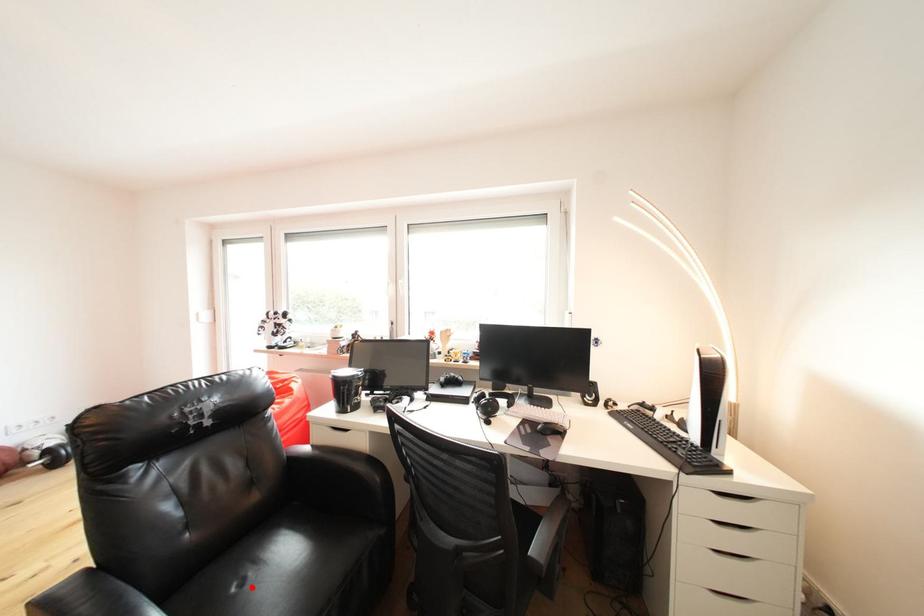
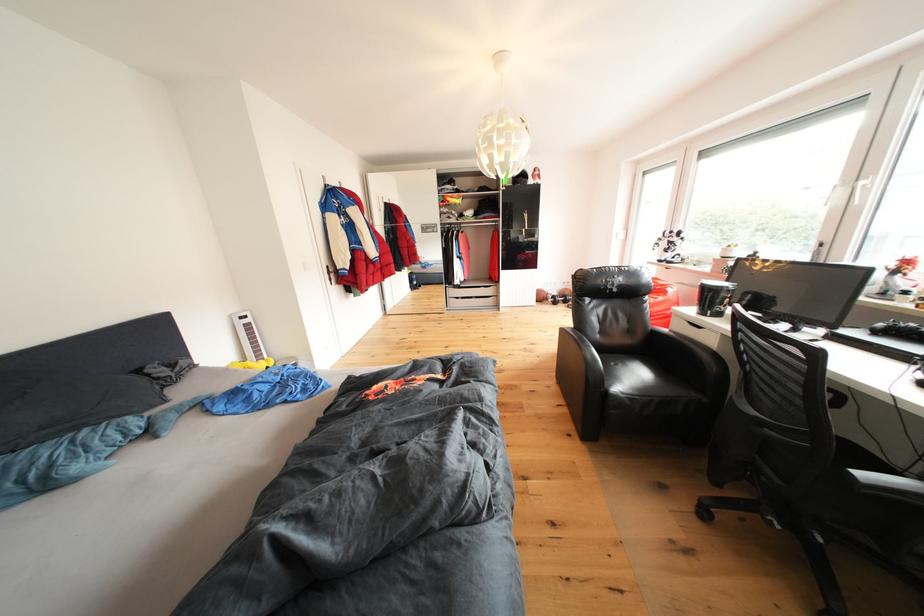
Question: I am providing you with two images of the same scene from different viewpoints. A red point is marked on the first image. At the location where the point appears in image 1, is it still visible in image 2?

Choices:
 (A) Yes
 (B) No

Answer: (A)